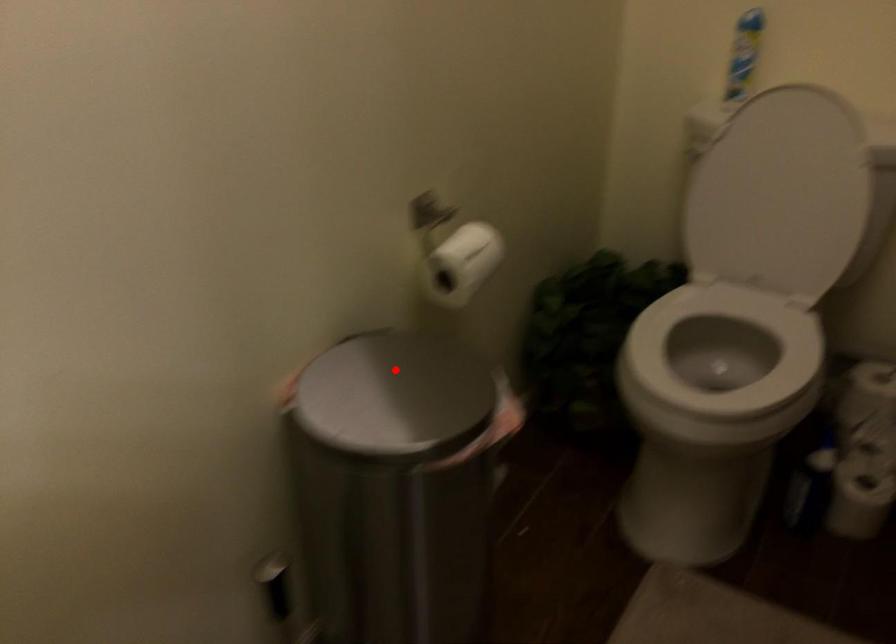
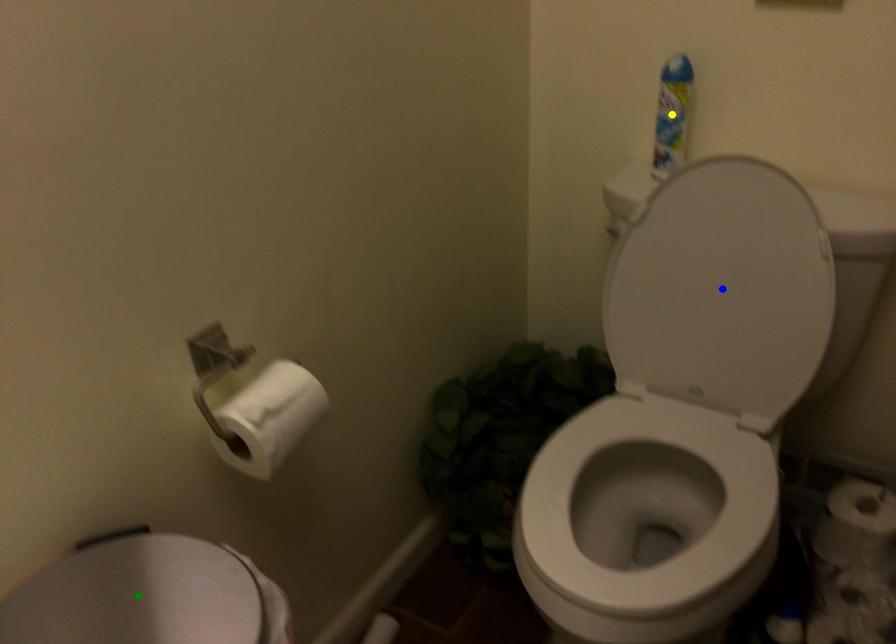
Question: I am providing you with two images of the same scene from different viewpoints. A red point is marked on the first image. You are given multiple points on the second image. Which spot in image 2 lines up with the point in image 1?

Choices:
 (A) green point
 (B) blue point
 (C) yellow point

Answer: (A)